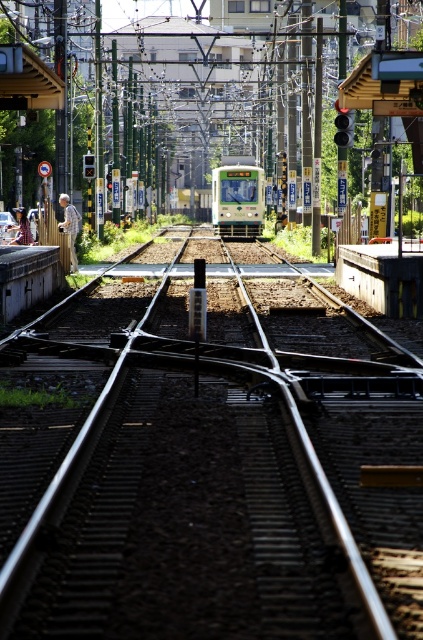
You are standing on the platform at the station and see two points marked on the tracks. The first point is at coordinate point (219, 570) and the second is at point (222, 228). From your perspective, which point is closer to you?

Point (219, 570) is in front of point (222, 228), so the first point is closer to you.

You are standing on the platform observing the metallic train tracks at center and the green matte train at center. According to the scene, which object is positioned lower relative to the other?

The metallic train tracks at center are located below the green matte train at center, so the metallic train tracks at center are positioned lower.

You are a maintenance worker checking the width compatibility between the metallic train tracks at center and the green matte train at center. Which object has a greater width?

The metallic train tracks at center has a greater width than the green matte train at center, as stated in the description.